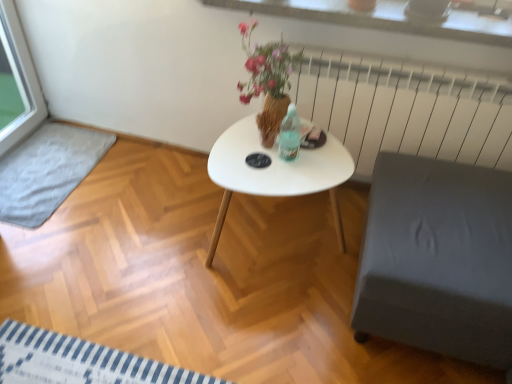
This screenshot has height=384, width=512. I want to click on empty space that is ontop of white matte coffee table at center (from a real-world perspective), so click(x=289, y=158).